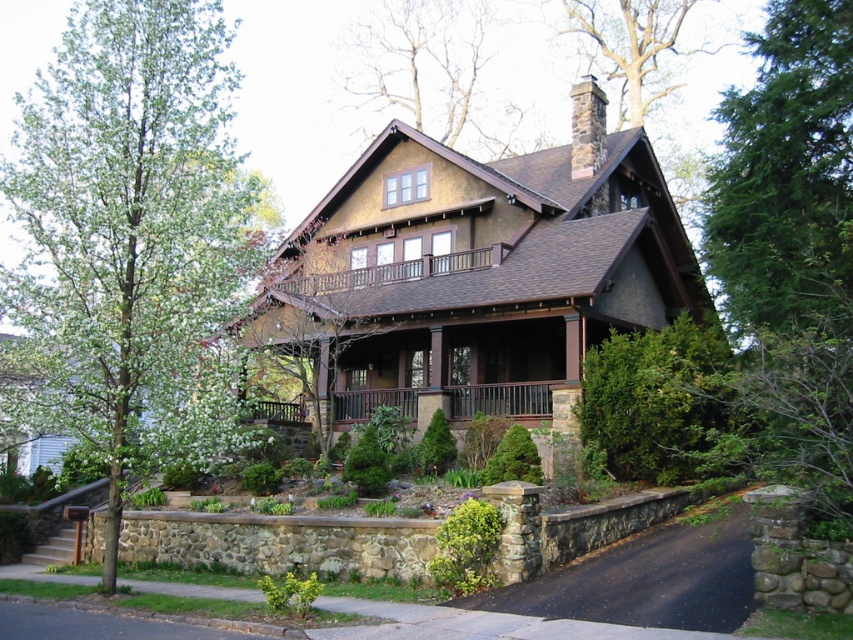
Question: Considering the relative positions of green leafy tree at left and brown wooden porch at center in the image provided, where is green leafy tree at left located with respect to brown wooden porch at center?

Choices:
 (A) below
 (B) above

Answer: (B)

Question: Among these objects, which one is farthest from the camera?

Choices:
 (A) green leafy tree at upper right
 (B) bare branches at upper center

Answer: (B)

Question: Which object appears farthest from the camera in this image?

Choices:
 (A) green leafy tree at upper right
 (B) green leafy tree at center
 (C) bare branches at upper center

Answer: (C)

Question: Which object is closer to the camera taking this photo?

Choices:
 (A) brown wooden porch at center
 (B) green leafy tree at center
 (C) bare branches at upper center

Answer: (B)

Question: Where is green leafy tree at center located in relation to brown wooden porch at center in the image?

Choices:
 (A) left
 (B) right

Answer: (A)

Question: Is green leafy tree at left in front of brown wooden porch at center?

Choices:
 (A) no
 (B) yes

Answer: (B)